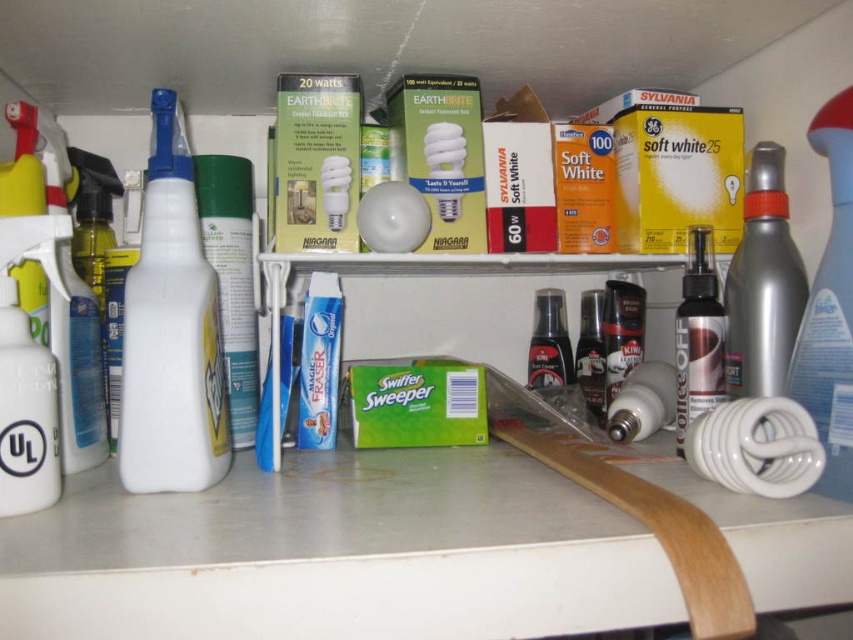
You are organizing a utility room and need to place a 12 inch wide box between the white glossy counter top at lower center and the silver metallic spray can at right. Is there enough space between them to fit the box?

The distance between the white glossy counter top at lower center and the silver metallic spray can at right is 13.78 inches. Since the box is 12 inches wide, there is enough space to fit it between them.